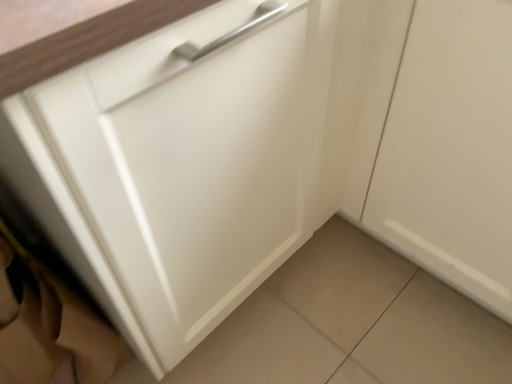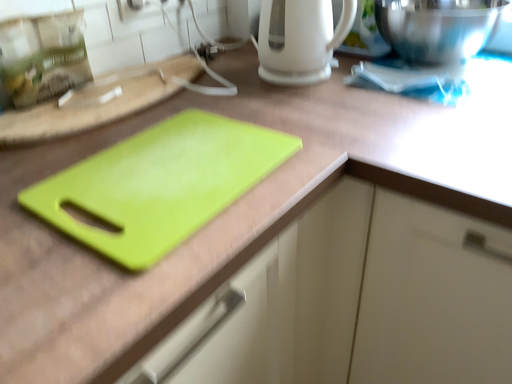
Question: How did the camera likely rotate when shooting the video?

Choices:
 (A) rotated downward
 (B) rotated upward

Answer: (B)